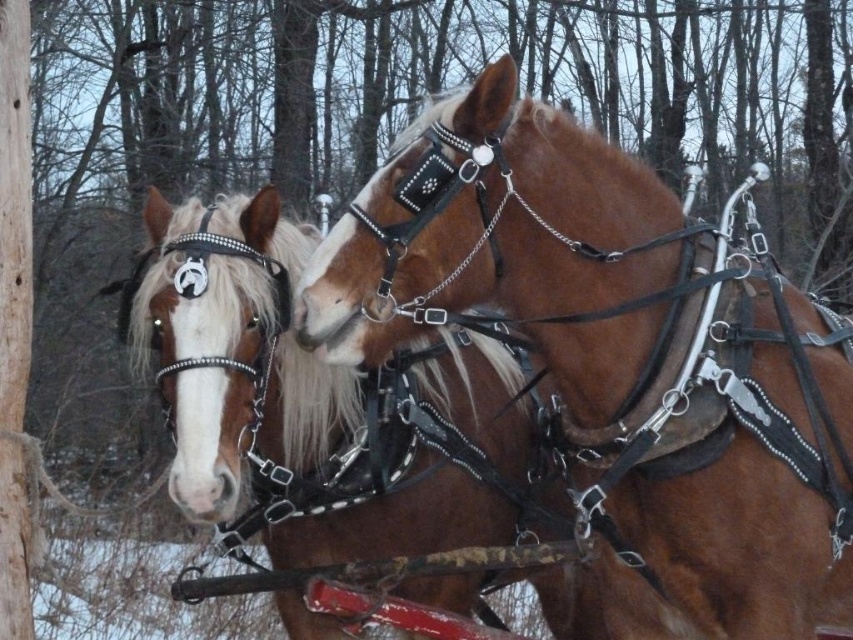
Between brown leather harness at center and brown leather horse at left, which one is positioned lower?

brown leather horse at left

Between brown leather harness at center and brown leather horse at left, which one is positioned higher?

brown leather harness at center

Between point (602, 493) and point (490, 340), which one is positioned behind?

Positioned behind is point (490, 340).

In order to click on brown leather harness at center in this screenshot , I will do `click(618, 360)`.